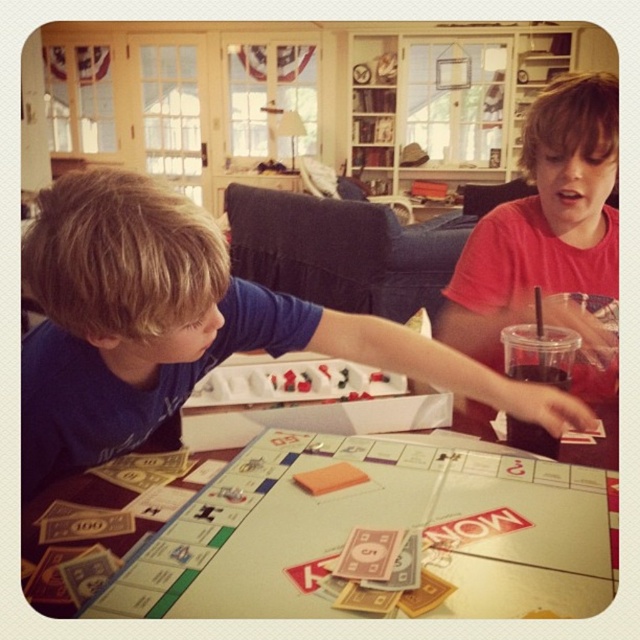
Where is `blue cotton shirt at center`? This screenshot has height=640, width=640. blue cotton shirt at center is located at coordinates (182, 326).

Does blue cotton shirt at center appear on the left side of translucent plastic cup with straw at lower right?

Yes, blue cotton shirt at center is to the left of translucent plastic cup with straw at lower right.

Who is more distant from viewer, (x=474, y=381) or (x=532, y=372)?

The point (x=532, y=372) is behind.

You are a GUI agent. You are given a task and a screenshot of the screen. Output one action in this format:
    pyautogui.click(x=<x>, y=<y>)
    Task: Click on the blue cotton shirt at center
    
    Given the screenshot: What is the action you would take?
    pyautogui.click(x=182, y=326)

Who is more distant from viewer, (186, 595) or (513, 419)?

The point (513, 419) is more distant.

Who is higher up, white glossy monopoly board at center or translucent plastic cup with straw at lower right?

Positioned higher is translucent plastic cup with straw at lower right.

The image size is (640, 640). Identify the location of white glossy monopoly board at center. (376, 525).

Is blue cotton shirt at center taller than matte pink shirt at upper right?

In fact, blue cotton shirt at center may be shorter than matte pink shirt at upper right.

Measure the distance from blue cotton shirt at center to matte pink shirt at upper right.

blue cotton shirt at center and matte pink shirt at upper right are 16.93 inches apart from each other.

Between point (28, 448) and point (552, 234), which one is positioned behind?

The point (552, 234) is behind.

You are a GUI agent. You are given a task and a screenshot of the screen. Output one action in this format:
    pyautogui.click(x=<x>, y=<y>)
    Task: Click on the blue cotton shirt at center
    The image size is (640, 640).
    Given the screenshot: What is the action you would take?
    pyautogui.click(x=182, y=326)